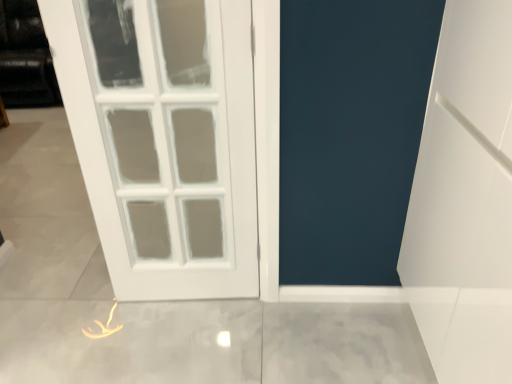
Where is `white glass door at left`? white glass door at left is located at coordinates (177, 141).

What do you see at coordinates (177, 141) in the screenshot? I see `white glass door at left` at bounding box center [177, 141].

Measure the distance between point (x=227, y=249) and camera.

They are 5.29 feet apart.

Locate an element on the screen. Image resolution: width=512 pixels, height=384 pixels. white glass door at left is located at coordinates (177, 141).